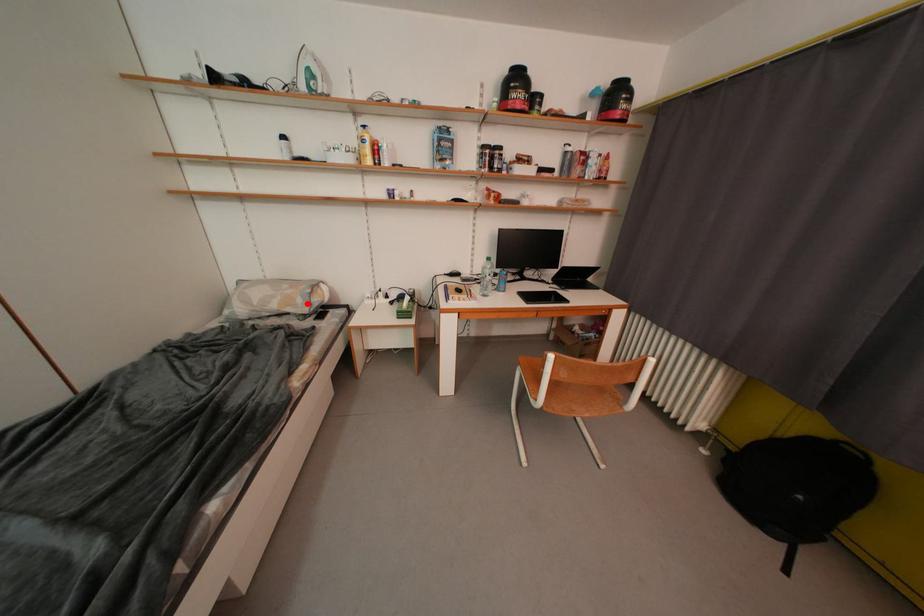
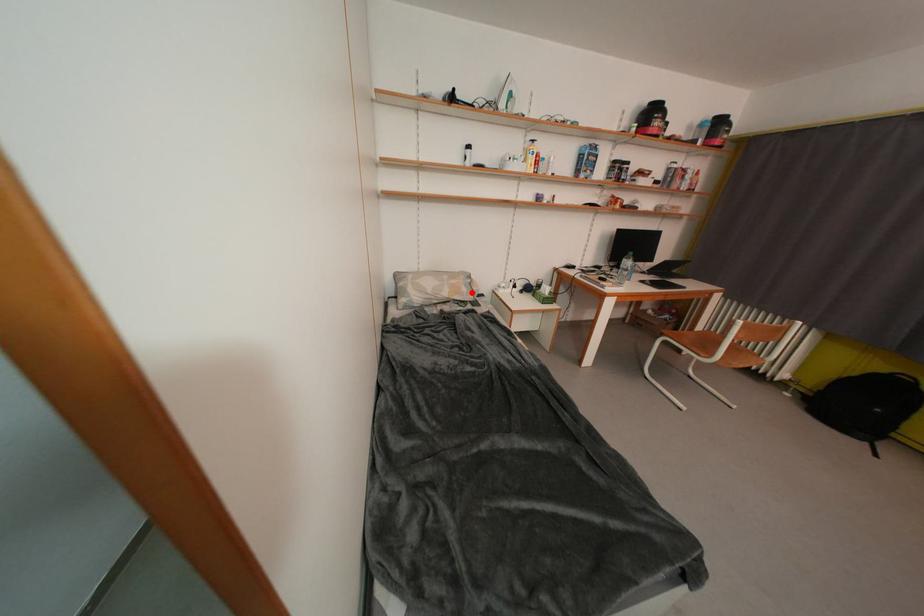
Based on the photo, I am providing you with two images of the same scene from different viewpoints. A red point is marked on the first image and another point is marked on the second image. Is the marked point in image1 the same physical position as the marked point in image2?

Yes